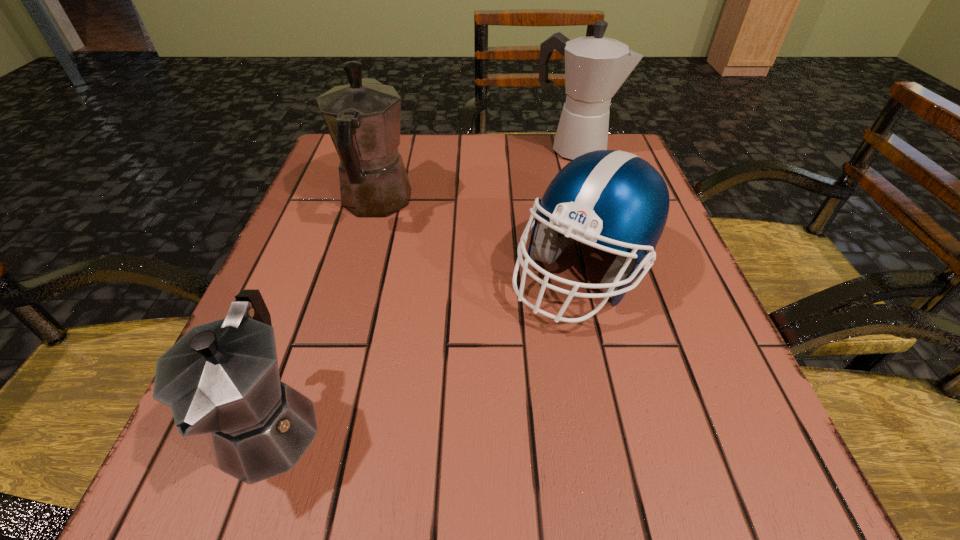
Where is `coffeepot located in the right edge section of the desktop`? Image resolution: width=960 pixels, height=540 pixels. coffeepot located in the right edge section of the desktop is located at coordinates (595, 67).

Locate an element on the screen. The image size is (960, 540). football helmet that is at the right edge is located at coordinates (614, 198).

Where is `object located in the far left corner section of the desktop`? object located in the far left corner section of the desktop is located at coordinates (363, 118).

Find the location of a particular element. object that is at the near left corner is located at coordinates (222, 377).

Where is `object that is positioned at the far right corner`? Image resolution: width=960 pixels, height=540 pixels. object that is positioned at the far right corner is located at coordinates (595, 67).

Image resolution: width=960 pixels, height=540 pixels. In the image, there is a desktop. In order to click on vacant space at the far edge in this screenshot , I will do `click(470, 144)`.

What are the coordinates of `free space at the near edge of the desktop` in the screenshot? It's located at (613, 478).

Image resolution: width=960 pixels, height=540 pixels. Find the location of `free space at the left edge of the desktop`. free space at the left edge of the desktop is located at coordinates (286, 374).

Find the location of `vacant space at the right edge`. vacant space at the right edge is located at coordinates (663, 422).

What are the coordinates of `vacant space at the near left corner` in the screenshot? It's located at (297, 479).